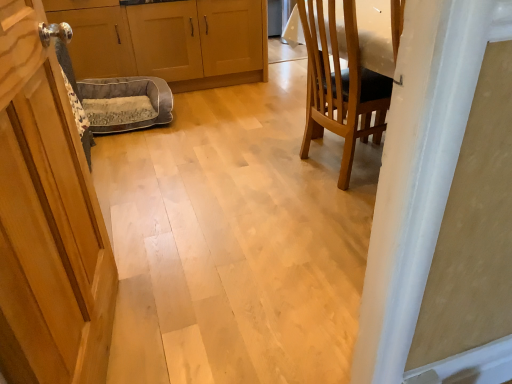
Find the location of a particular element. free area in between wooden door at left and wooden chair at right is located at coordinates (242, 248).